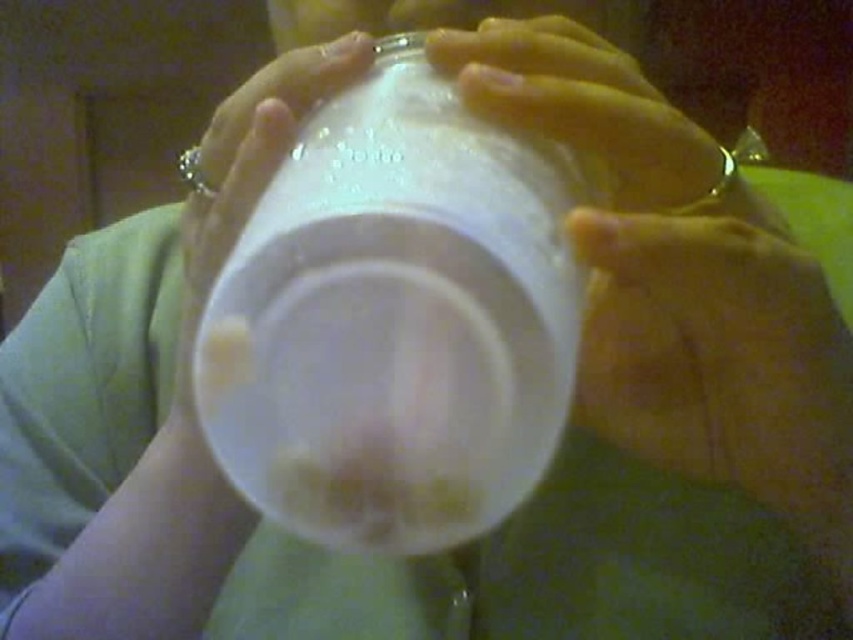
You are at a party and need to pour a drink into the translucent plastic cup at center. However, there is a yellow fabric at lower right nearby. Considering their heights, can you place the cup on top of the yellow fabric without it tipping over?

The translucent plastic cup at center is taller than the yellow fabric at lower right. Since the cup is taller, placing it on top might cause instability, so it could tip over.

You are a bartender preparing a drink and notice the translucent plastic cup at center and the yellow fabric at lower right in your view. Which object is closer to the top of the image?

The translucent plastic cup at center is located above the yellow fabric at lower right, so it is closer to the top of the image.

You are trying to locate the translucent plastic cup at center in the image. According to the coordinates provided, where exactly is it positioned?

The translucent plastic cup at center is located at point (395, 321).